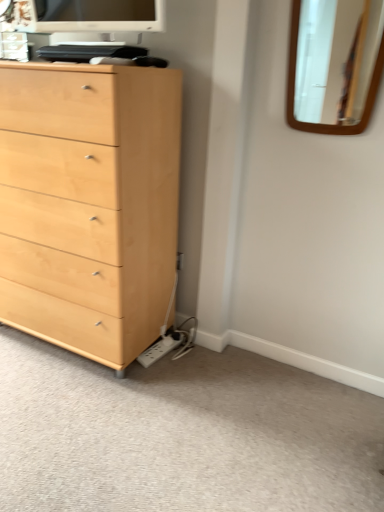
This screenshot has height=512, width=384. Identify the location of free space to the right of light wood chest of drawers at left. (205, 381).